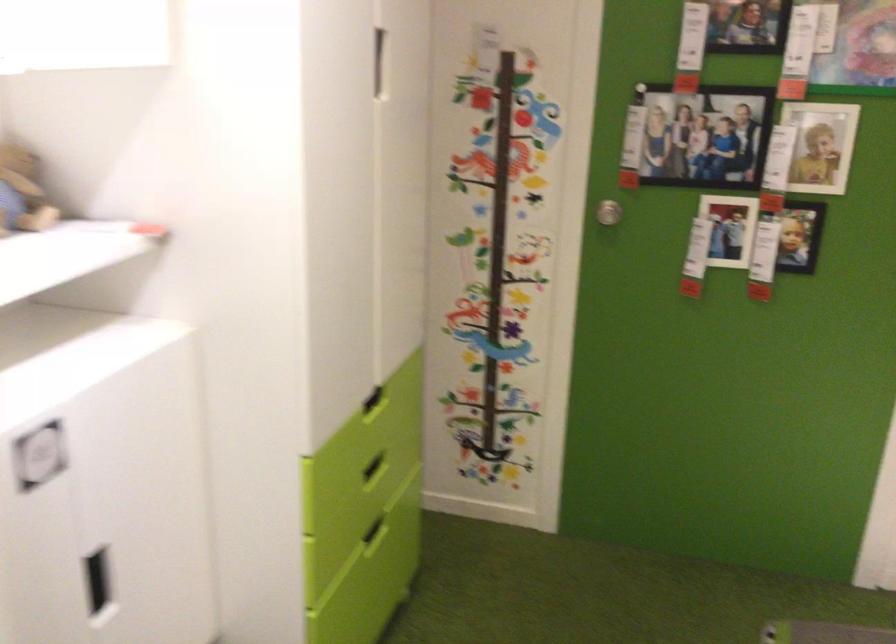
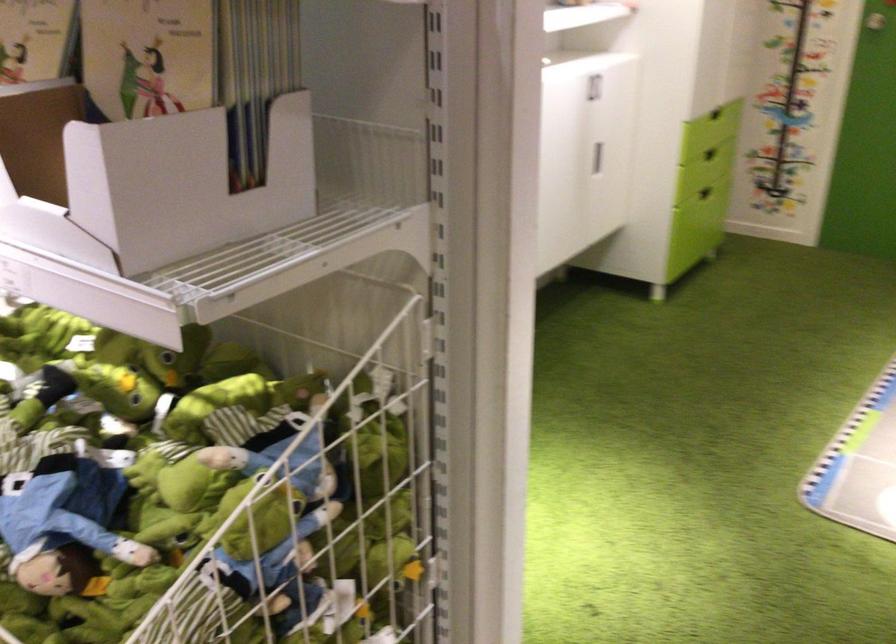
The point at (373, 401) is marked in the first image. Where is the corresponding point in the second image?

(720, 126)